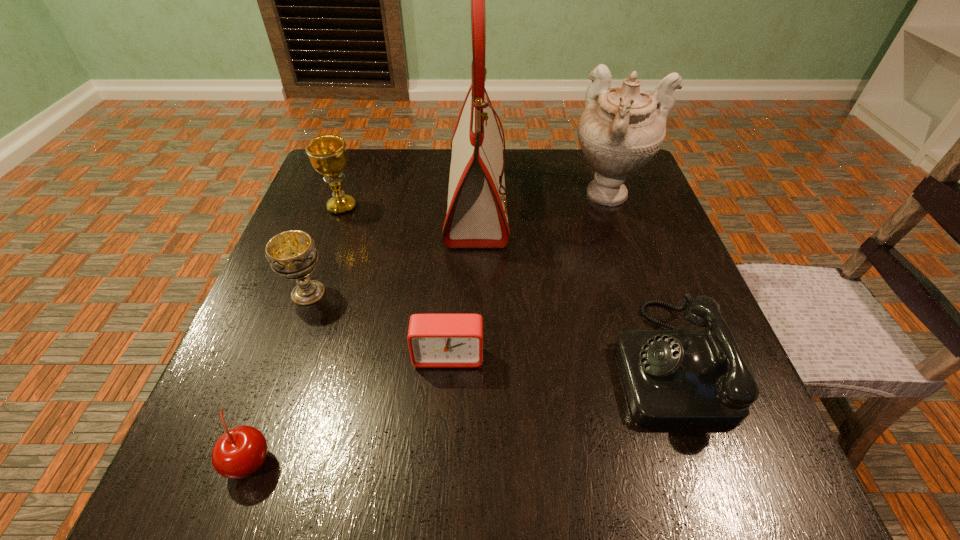
I want to click on vacant space at the far right corner, so click(x=587, y=200).

Image resolution: width=960 pixels, height=540 pixels. Identify the location of vacant space at the near right corner of the desktop. (750, 454).

At what (x,y) coordinates should I click in order to perform the action: click on vacant region between the cherry and the alarm clock. Please return your answer as a coordinate pair (x, y). This screenshot has height=540, width=960. Looking at the image, I should click on (349, 408).

Identify the location of free spot between the tallest object and the nearer chalice. (393, 244).

Where is `free spot between the shorter chalice and the cherry`? This screenshot has height=540, width=960. free spot between the shorter chalice and the cherry is located at coordinates pyautogui.click(x=279, y=377).

Identify the location of vacant space that is in between the handbag and the cherry. The width and height of the screenshot is (960, 540). (364, 327).

Find the location of a particular element. The image size is (960, 540). blank region between the handbag and the cherry is located at coordinates (364, 327).

This screenshot has width=960, height=540. In order to click on vacant space that's between the handbag and the taller chalice in this screenshot , I will do `click(409, 201)`.

Where is `free space that is in between the handbag and the second tallest object`? Image resolution: width=960 pixels, height=540 pixels. free space that is in between the handbag and the second tallest object is located at coordinates (543, 195).

The image size is (960, 540). What are the coordinates of `object that ranks as the closest to the telephone` in the screenshot? It's located at (477, 217).